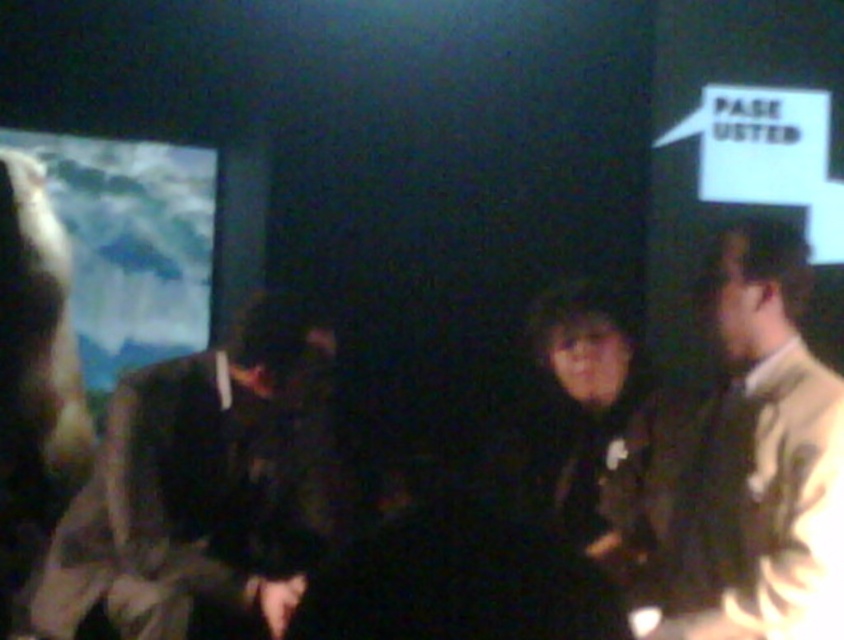
Which is more to the left, dark brown suit at left or light beige jacket at right?

From the viewer's perspective, dark brown suit at left appears more on the left side.

The width and height of the screenshot is (844, 640). Find the location of `dark brown suit at left`. dark brown suit at left is located at coordinates (203, 490).

The height and width of the screenshot is (640, 844). I want to click on dark brown suit at left, so click(203, 490).